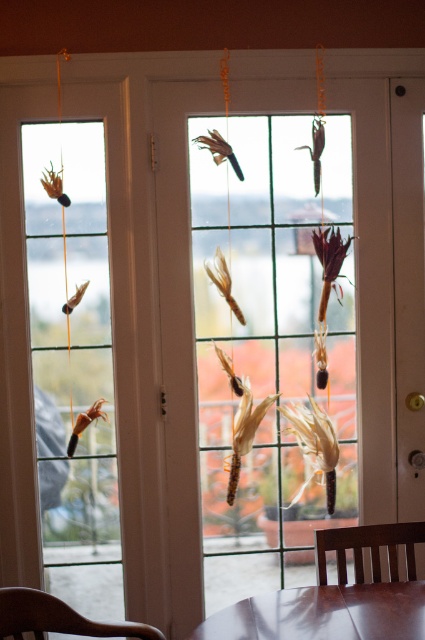
Between point (348, 586) and point (336, 541), which one is positioned in front?

Positioned in front is point (348, 586).

The height and width of the screenshot is (640, 425). Identify the location of glossy brown table at lower center. (323, 612).

Identify the location of glossy brown table at lower center. The image size is (425, 640). (323, 612).

Which is below, brown wood chair at lower left or brown wooden chair at lower center?

Positioned lower is brown wood chair at lower left.

Who is shorter, brown wood chair at lower left or brown wooden chair at lower center?

brown wooden chair at lower center

I want to click on brown wood chair at lower left, so click(x=57, y=618).

Is glossy brown table at lower center smaller than brown wood chair at lower left?

No, glossy brown table at lower center is not smaller than brown wood chair at lower left.

Can you confirm if glossy brown table at lower center is positioned to the left of brown wood chair at lower left?

No, glossy brown table at lower center is not to the left of brown wood chair at lower left.

Which is in front, point (342, 592) or point (5, 634)?

Point (5, 634)

Identify the location of glossy brown table at lower center. This screenshot has width=425, height=640. (323, 612).